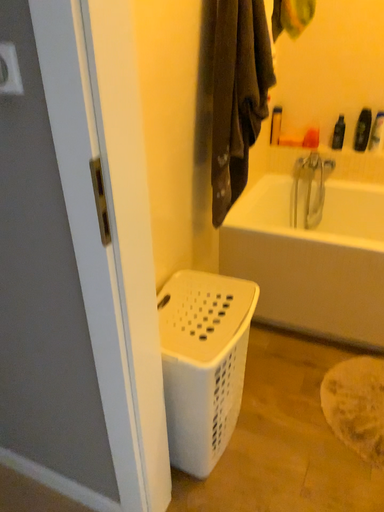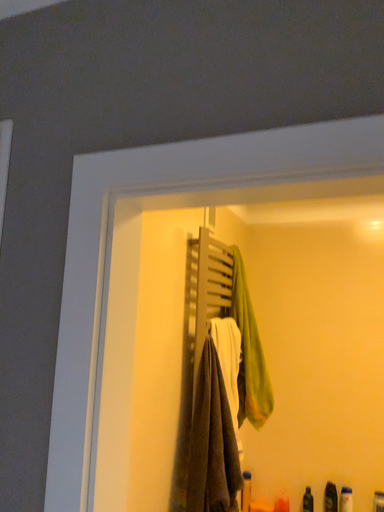
Question: How did the camera likely rotate when shooting the video?

Choices:
 (A) rotated upward
 (B) rotated downward

Answer: (A)